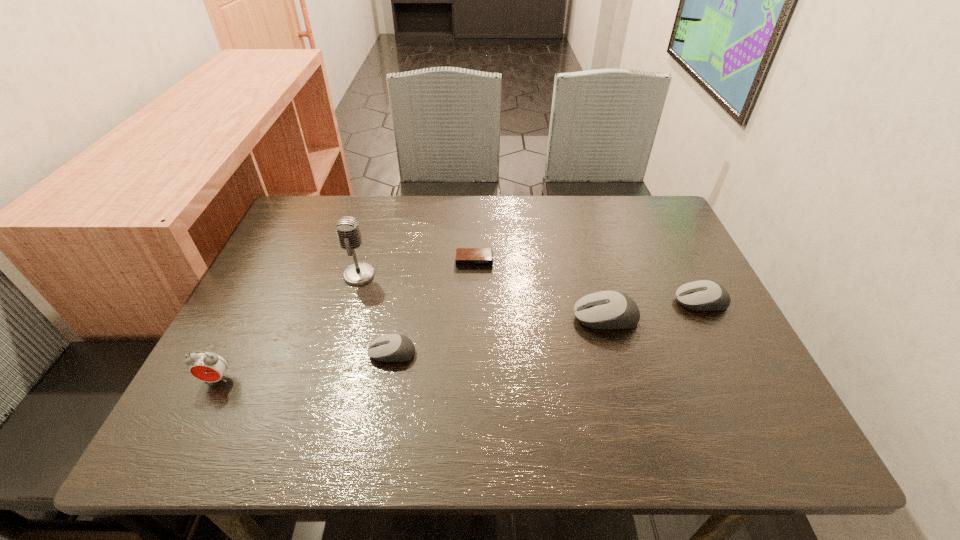
I want to click on the left alarm clock, so click(x=206, y=366).

This screenshot has height=540, width=960. I want to click on the taller alarm clock, so coord(206,366).

Where is `vacant space situated on the wheel side of the fourth object from right to left`? The image size is (960, 540). vacant space situated on the wheel side of the fourth object from right to left is located at coordinates (248, 353).

This screenshot has height=540, width=960. I want to click on free space located 0.270m on the wheel side of the fourth object from right to left, so click(x=243, y=353).

The width and height of the screenshot is (960, 540). Find the location of `free spot located on the wheel side of the fourth object from right to left`. free spot located on the wheel side of the fourth object from right to left is located at coordinates (284, 353).

Find the location of a particular element. vacant space located 0.150m on the wheel side of the second computer equipment from right to left is located at coordinates (508, 318).

Locate an element on the screen. This screenshot has height=540, width=960. vacant space located on the wheel side of the second computer equipment from right to left is located at coordinates (542, 318).

Locate an element on the screen. The height and width of the screenshot is (540, 960). vacant area situated on the wheel side of the second computer equipment from right to left is located at coordinates (547, 318).

This screenshot has width=960, height=540. In order to click on free space located on the wheel side of the third shortest object in this screenshot , I will do `click(637, 302)`.

You are a GUI agent. You are given a task and a screenshot of the screen. Output one action in this format:
    pyautogui.click(x=<x>, y=<y>)
    Task: Click on the vacant space located on the wheel side of the third shortest object
    This screenshot has height=540, width=960.
    Given the screenshot: What is the action you would take?
    pyautogui.click(x=645, y=302)